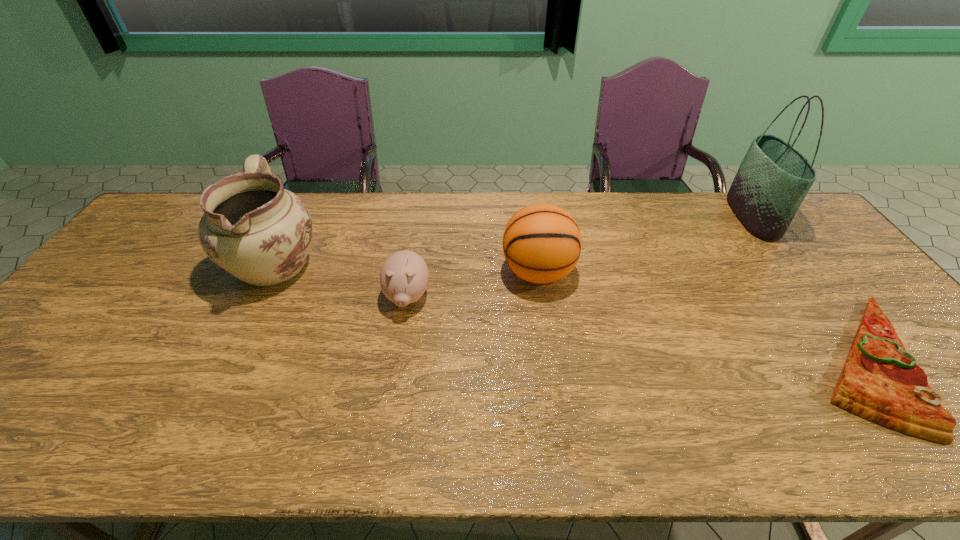
You are a GUI agent. You are given a task and a screenshot of the screen. Output one action in this format:
    pyautogui.click(x=<x>, y=<y>)
    Task: Click on the free space between the third object from left to right and the tote bag
    The width and height of the screenshot is (960, 540).
    Given the screenshot: What is the action you would take?
    pyautogui.click(x=645, y=244)

This screenshot has height=540, width=960. Identify the location of empty space that is in between the fourth object from right to left and the third object from right to left. (472, 285).

The height and width of the screenshot is (540, 960). I want to click on vacant area that lies between the third tallest object and the tallest object, so click(645, 244).

Where is `vacant space that is in between the tallest object and the third object from right to left`? vacant space that is in between the tallest object and the third object from right to left is located at coordinates (645, 244).

You are a GUI agent. You are given a task and a screenshot of the screen. Output one action in this format:
    pyautogui.click(x=<x>, y=<y>)
    Task: Click on the vacant point located between the pitcher and the second object from left to right
    Image resolution: width=960 pixels, height=540 pixels.
    Given the screenshot: What is the action you would take?
    [342, 280]

Locate which object is the closest to the pizza. Please provide its 2D coordinates. Your answer should be formatted as a tuple, i.e. [(x, y)], where the tuple contains the x and y coordinates of a point satisfying the conditions above.

[(774, 177)]

Identify the location of object that is the fourth closest one to the shortest object. The image size is (960, 540). (254, 229).